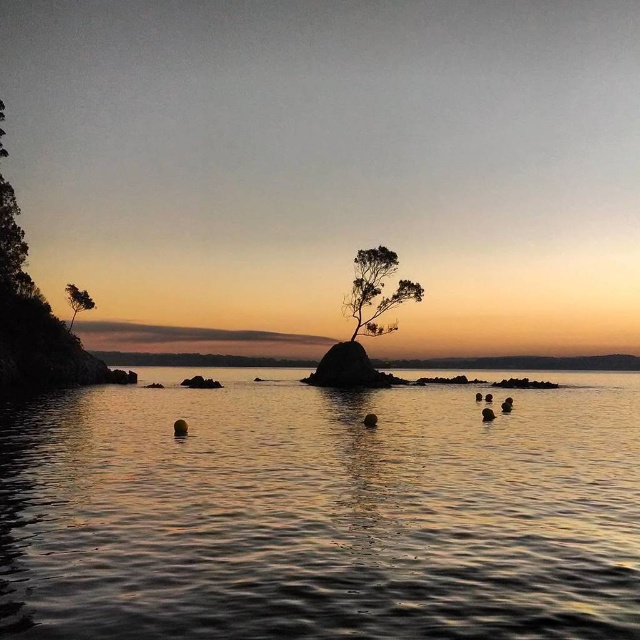
Question: Which point is farther to the camera?

Choices:
 (A) (365, 310)
 (B) (417, 522)

Answer: (A)

Question: Is silhouette wood tree at center to the left of green matte tree at left from the viewer's perspective?

Choices:
 (A) no
 (B) yes

Answer: (A)

Question: Which object appears farthest from the camera in this image?

Choices:
 (A) glistening water at center
 (B) green matte tree at left

Answer: (B)

Question: Considering the real-world distances, which object is closest to the silhouette wood tree at center?

Choices:
 (A) green matte tree at left
 (B) glistening water at center

Answer: (B)

Question: Considering the relative positions of silhouette wood tree at center and green matte tree at left in the image provided, where is silhouette wood tree at center located with respect to green matte tree at left?

Choices:
 (A) right
 (B) left

Answer: (A)

Question: Is silhouette wood tree at center positioned behind green matte tree at left?

Choices:
 (A) yes
 (B) no

Answer: (B)